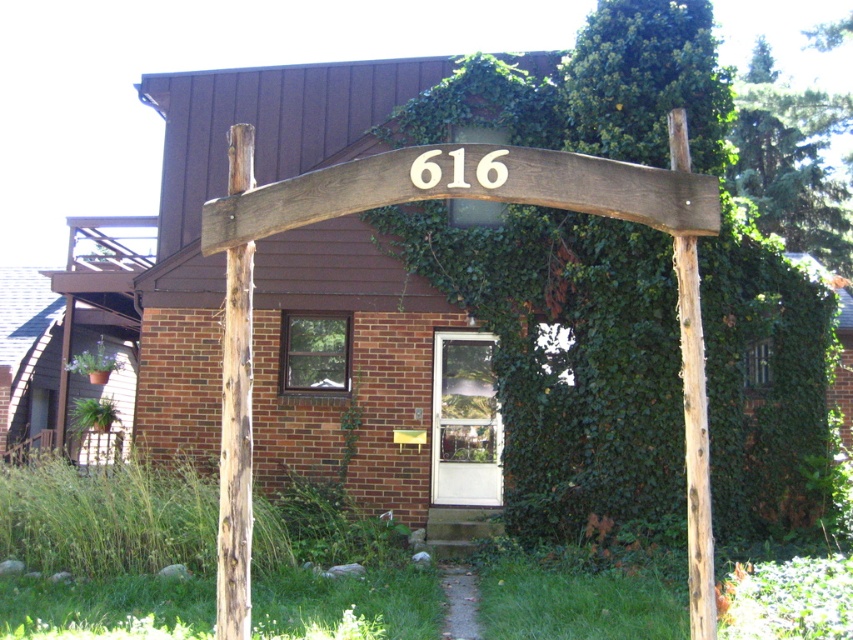
You are standing in front of the house and want to determine which of the two points, point (x=234, y=131) or point (x=697, y=308), is closer to you. Based on the image, which point is nearer?

Point (x=234, y=131) is further to the viewer than point (x=697, y=308), so the closer point to you is point (x=697, y=308).

You are standing in front of the house and notice two wooden posts. The rough wooden post at center and the brown rough wood post at right. Which post is higher up from the ground?

The rough wooden post at center is above the brown rough wood post at right, so the rough wooden post at center is higher up from the ground.